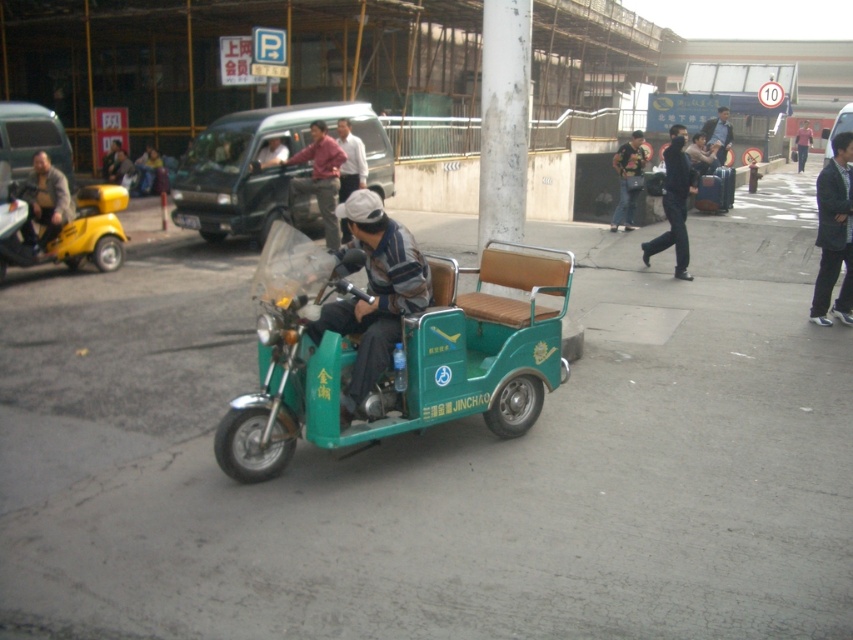
Question: Which of the following is the closest to the observer?

Choices:
 (A) pink fabric jacket at upper right
 (B) striped fabric jacket at center
 (C) black fabric jacket at right

Answer: (B)

Question: Based on their relative distances, which object is farther from the matte red shirt at center?

Choices:
 (A) black fabric jacket at right
 (B) matte black scooter at left

Answer: (A)

Question: Does striped fabric jacket at center appear under matte red shirt at center?

Choices:
 (A) yes
 (B) no

Answer: (A)

Question: From the image, what is the correct spatial relationship of striped fabric jacket at center in relation to black smooth jacket at center?

Choices:
 (A) right
 (B) left

Answer: (B)

Question: Does black smooth jacket at center come behind brown leather jacket at left?

Choices:
 (A) no
 (B) yes

Answer: (B)

Question: Which point is closer to the camera?

Choices:
 (A) (227, 164)
 (B) (32, 224)
 (C) (312, 125)

Answer: (B)